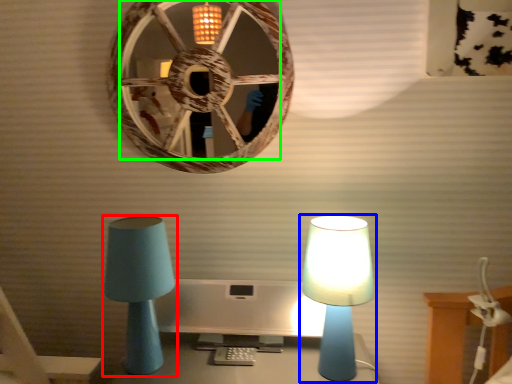
Question: Which is farther away from lamp (highlighted by a red box)? lamp (highlighted by a blue box) or mirror (highlighted by a green box)?

Choices:
 (A) lamp
 (B) mirror

Answer: (B)